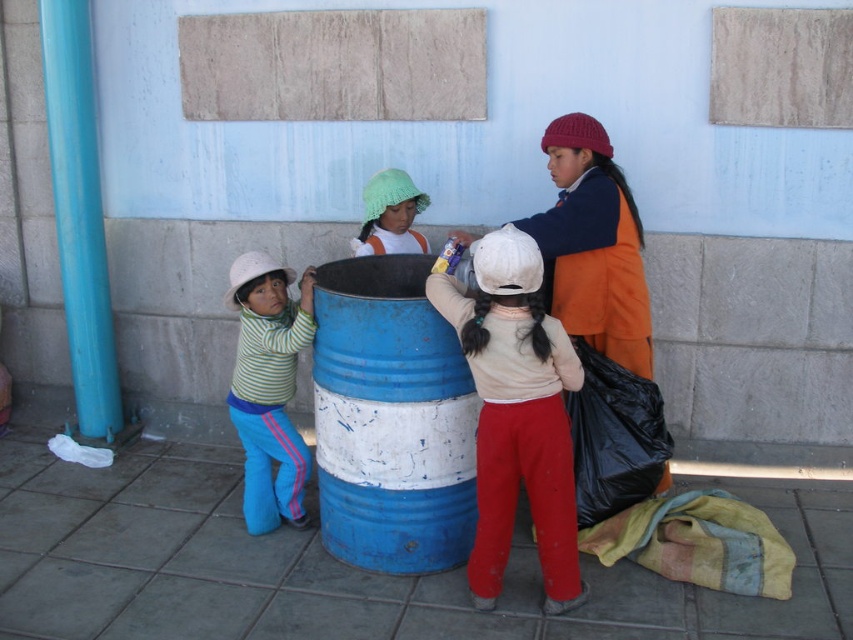
You are standing at point (x=392, y=419). What object are you standing on?

You are standing on the blue painted metal barrel at center.

You are a photographer setting up a shot of the scene. You want to ensure the matte white hat at center and the striped cotton shirt at left are both visible in the frame. Which object should you focus on first to make sure both are in the frame?

You should focus on the striped cotton shirt at left first because the matte white hat at center is positioned under it. By ensuring the shirt is in the frame, the hat below it will naturally be included as well.